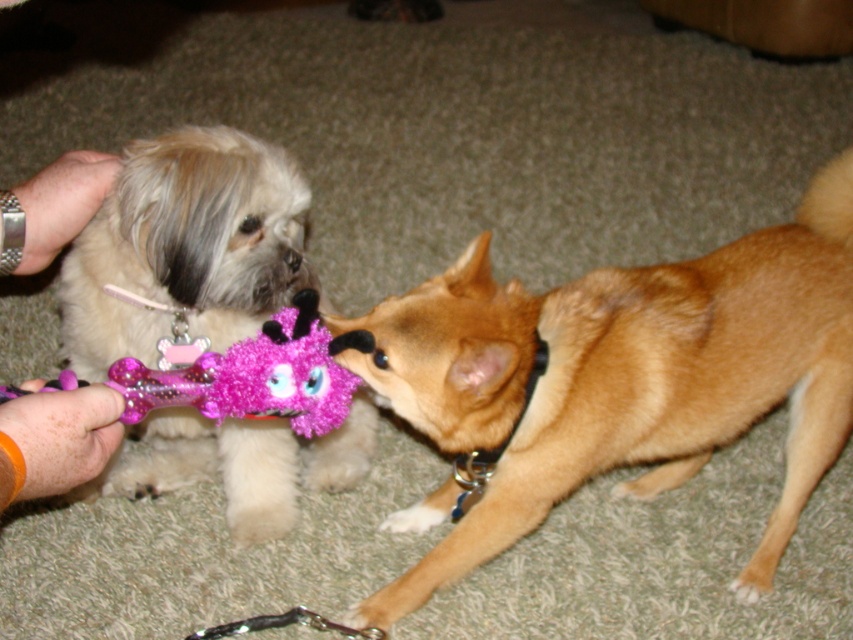
Does fluffy beige dog at center have a larger size compared to smooth skin hand at upper left?

Yes.

In the scene shown: Is fluffy beige dog at center smaller than smooth skin hand at upper left?

No.

I want to click on fluffy beige dog at center, so click(x=184, y=250).

Is shiny brown fur at center to the right of fluffy beige dog at center from the viewer's perspective?

Indeed, shiny brown fur at center is positioned on the right side of fluffy beige dog at center.

This screenshot has width=853, height=640. Find the location of `shiny brown fur at center`. shiny brown fur at center is located at coordinates (621, 378).

Measure the distance between point (x=463, y=369) and camera.

Point (x=463, y=369) and camera are 1.15 meters apart from each other.

The height and width of the screenshot is (640, 853). Find the location of `shiny brown fur at center`. shiny brown fur at center is located at coordinates (621, 378).

Between shiny brown fur at center and black fur nose at center, which one has more height?

shiny brown fur at center is taller.

Can you confirm if shiny brown fur at center is positioned above black fur nose at center?

→ No.

Who is more distant from viewer, (596,358) or (283,253)?

The point (283,253) is more distant.

You are a GUI agent. You are given a task and a screenshot of the screen. Output one action in this format:
    pyautogui.click(x=<x>, y=<y>)
    Task: Click on the shiny brown fur at center
    The height and width of the screenshot is (640, 853).
    Given the screenshot: What is the action you would take?
    pyautogui.click(x=621, y=378)